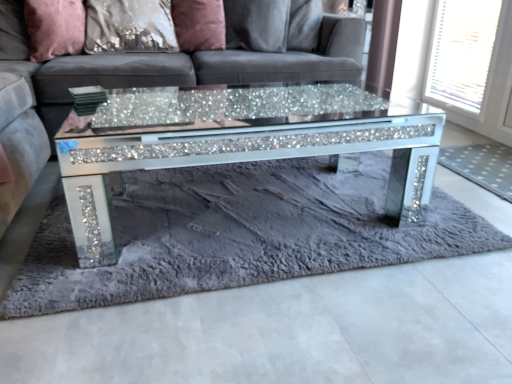
Question: In terms of height, does sparkly glass coffee table at center look taller or shorter compared to pink velvet pillow at upper left, which is the first pillow in left-to-right order?

Choices:
 (A) tall
 (B) short

Answer: (A)

Question: Which is correct: sparkly glass coffee table at center is inside pink velvet pillow at upper left, which is counted as the third pillow, starting from the right, or outside of it?

Choices:
 (A) outside
 (B) inside

Answer: (A)

Question: Which object is the farthest from the satin pink pillow at upper center, the first pillow positioned from the right?

Choices:
 (A) pink velvet pillow at upper left, which is the first pillow in left-to-right order
 (B) satin sequin pillow at upper center, arranged as the second pillow when viewed from the left
 (C) white mesh screen at upper right
 (D) white dotted mat at right, the 2th mat in the left-to-right sequence
 (E) fuzzy gray rug at center, the second mat positioned from the right

Answer: (C)

Question: Which of these objects is positioned farthest from the satin pink pillow at upper center, the third pillow from the left?

Choices:
 (A) velvet grey couch at center
 (B) sparkly glass coffee table at center
 (C) pink velvet pillow at upper left, which is counted as the third pillow, starting from the right
 (D) satin sequin pillow at upper center, arranged as the second pillow when viewed from the left
 (E) white dotted mat at right, the 2th mat in the left-to-right sequence

Answer: (E)